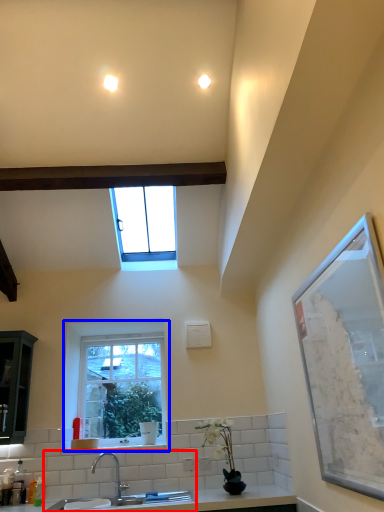
Question: Which of the following is the closest to the observer, sink (highlighted by a red box) or window (highlighted by a blue box)?

Choices:
 (A) sink
 (B) window

Answer: (A)